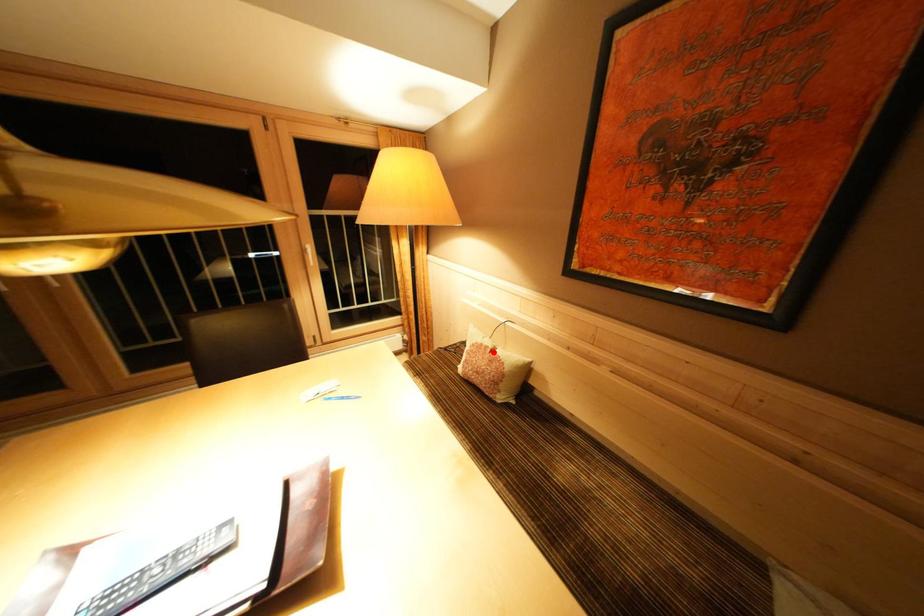
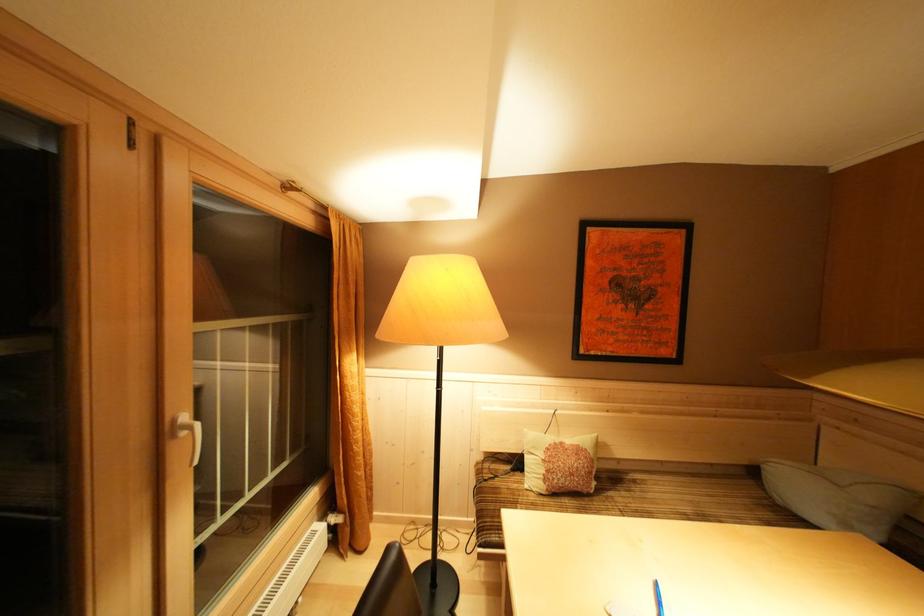
Question: I am providing you with two images of the same scene from different viewpoints. A red point is marked on the first image. Is the red point's position out of view in image 2?

Choices:
 (A) Yes
 (B) No

Answer: (B)